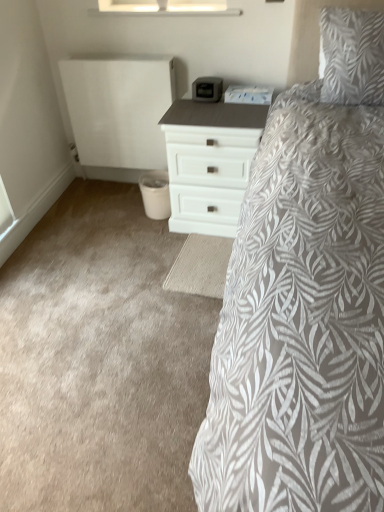
You are a GUI agent. You are given a task and a screenshot of the screen. Output one action in this format:
    pyautogui.click(x=<x>, y=<y>)
    Task: Click on the transparent glass window at upper center
    The width and height of the screenshot is (384, 512).
    Given the screenshot: What is the action you would take?
    pyautogui.click(x=166, y=7)

Looking at the image, does white leaf-patterned pillow at upper right seem bigger or smaller compared to white matte chest of drawers at center?

Clearly, white leaf-patterned pillow at upper right is smaller in size than white matte chest of drawers at center.

Is white leaf-patterned pillow at upper right positioned with its back to white matte chest of drawers at center?

No, white leaf-patterned pillow at upper right's orientation is not away from white matte chest of drawers at center.

Which object is further away from the camera taking this photo, white leaf-patterned pillow at upper right or white matte chest of drawers at center?

white matte chest of drawers at center is behind.

Is white leaf-patterned pillow at upper right not near white matte chest of drawers at center?

No, there isn't a large distance between white leaf-patterned pillow at upper right and white matte chest of drawers at center.

Does transparent glass window at upper center turn towards white matte chest of drawers at center?

No, transparent glass window at upper center does not turn towards white matte chest of drawers at center.

Can we say transparent glass window at upper center lies outside white matte chest of drawers at center?

transparent glass window at upper center is positioned outside white matte chest of drawers at center.

Does point (133, 0) come closer to viewer compared to point (180, 217)?

Yes, point (133, 0) is in front of point (180, 217).

How distant is transparent glass window at upper center from white matte chest of drawers at center?

A distance of 27.68 inches exists between transparent glass window at upper center and white matte chest of drawers at center.

Which object is positioned more to the left, white leaf-patterned pillow at upper right or transparent glass window at upper center?

transparent glass window at upper center.

From a real-world perspective, which object stands above the other?

In real-world perspective, transparent glass window at upper center is above.

Are white leaf-patterned pillow at upper right and transparent glass window at upper center far apart?

white leaf-patterned pillow at upper right is near transparent glass window at upper center, not far away.

In the image, is white matte chest of drawers at center positioned in front of or behind white leaf-patterned pillow at upper right?

Visually, white matte chest of drawers at center is located behind white leaf-patterned pillow at upper right.

Locate an element on the screen. pillow that appears on the right of white matte chest of drawers at center is located at coordinates (352, 56).

Can you confirm if white matte chest of drawers at center is taller than white leaf-patterned pillow at upper right?

Correct, white matte chest of drawers at center is much taller as white leaf-patterned pillow at upper right.

Is white matte chest of drawers at center positioned behind transparent glass window at upper center?

No.

Is white matte chest of drawers at center thinner than transparent glass window at upper center?

No, white matte chest of drawers at center is not thinner than transparent glass window at upper center.

From the image's perspective, is white matte chest of drawers at center above or below transparent glass window at upper center?

Based on their image positions, white matte chest of drawers at center is located beneath transparent glass window at upper center.

Would you say transparent glass window at upper center is part of white matte chest of drawers at center's contents?

No, transparent glass window at upper center is not inside white matte chest of drawers at center.

Consider the image. From the image's perspective, is transparent glass window at upper center on white leaf-patterned pillow at upper right?

Indeed, from the image's perspective, transparent glass window at upper center is shown above white leaf-patterned pillow at upper right.

Can you confirm if transparent glass window at upper center is shorter than white leaf-patterned pillow at upper right?

Yes, transparent glass window at upper center is shorter than white leaf-patterned pillow at upper right.

Can you confirm if transparent glass window at upper center is smaller than white leaf-patterned pillow at upper right?

Correct, transparent glass window at upper center occupies less space than white leaf-patterned pillow at upper right.

Considering the sizes of objects transparent glass window at upper center and white leaf-patterned pillow at upper right in the image provided, who is wider, transparent glass window at upper center or white leaf-patterned pillow at upper right?

Wider between the two is white leaf-patterned pillow at upper right.

Find the location of a particular element. Image resolution: width=384 pixels, height=512 pixels. chest of drawers below the white leaf-patterned pillow at upper right (from the image's perspective) is located at coordinates (210, 160).

Locate an element on the screen. window positioned vertically above the white matte chest of drawers at center (from a real-world perspective) is located at coordinates (166, 7).

When comparing their distances from white leaf-patterned pillow at upper right, does white matte chest of drawers at center or transparent glass window at upper center seem further?

transparent glass window at upper center lies further to white leaf-patterned pillow at upper right than the other object.

When comparing their distances from white matte chest of drawers at center, does white leaf-patterned pillow at upper right or transparent glass window at upper center seem closer?

white leaf-patterned pillow at upper right.

Looking at this image, based on their spatial positions, is transparent glass window at upper center or white matte chest of drawers at center closer to white leaf-patterned pillow at upper right?

The object closer to white leaf-patterned pillow at upper right is white matte chest of drawers at center.

Looking at the image, which one is located closer to transparent glass window at upper center, white matte chest of drawers at center or white leaf-patterned pillow at upper right?

Based on the image, white leaf-patterned pillow at upper right appears to be nearer to transparent glass window at upper center.

When comparing their distances from transparent glass window at upper center, does white leaf-patterned pillow at upper right or white matte chest of drawers at center seem further?

white matte chest of drawers at center is further to transparent glass window at upper center.

Estimate the real-world distances between objects in this image. Which object is closer to white matte chest of drawers at center, transparent glass window at upper center or white leaf-patterned pillow at upper right?

Among the two, white leaf-patterned pillow at upper right is located nearer to white matte chest of drawers at center.

Image resolution: width=384 pixels, height=512 pixels. I want to click on chest of drawers between transparent glass window at upper center and white leaf-patterned pillow at upper right in the horizontal direction, so click(210, 160).